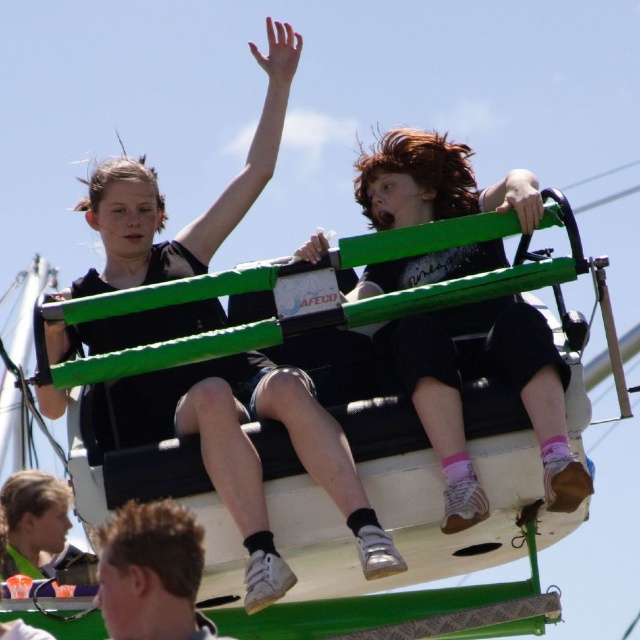
Which is behind, point (394, 579) or point (212, 454)?

Point (394, 579)

This screenshot has width=640, height=640. What are the coordinates of `green painted metal amusement ride at center` in the screenshot? It's located at (317, 488).

I want to click on green painted metal amusement ride at center, so click(x=317, y=488).